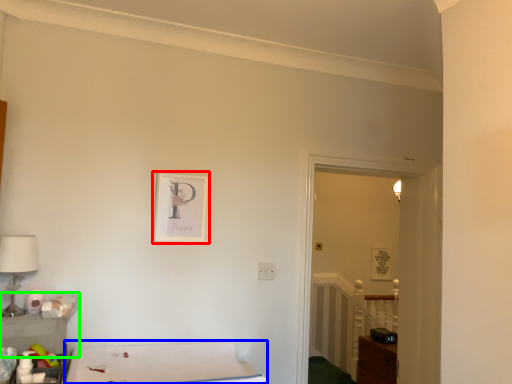
Question: Based on their relative distances, which object is farther from picture frame (highlighted by a red box)? Choose from furniture (highlighted by a blue box) and table (highlighted by a green box).

Choices:
 (A) furniture
 (B) table

Answer: (B)